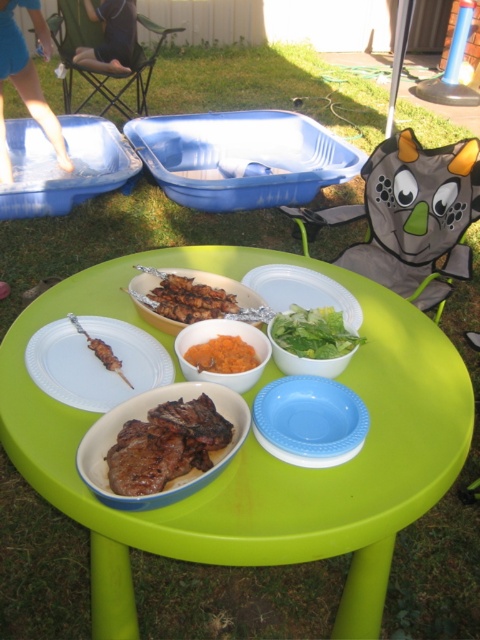
You are standing at the camera position looking at the matte yellow bowl at center. If you take one step forward, will the bowl appear larger in your view?

The matte yellow bowl at center is 3.91 feet away from the camera. If you move closer by taking one step forward, the bowl will appear larger in your view because it is now closer to you.

You are setting up a picnic table and need to place a drink in the exact center of the table. There is a matte yellow bowl at center and a blue plastic plate at center. Which object should you use as a reference to ensure the drink is centered?

The matte yellow bowl at center is to the left of the blue plastic plate at center. To center the drink, you should position it between the two objects, equidistant from both the matte yellow bowl at center and the blue plastic plate at center.